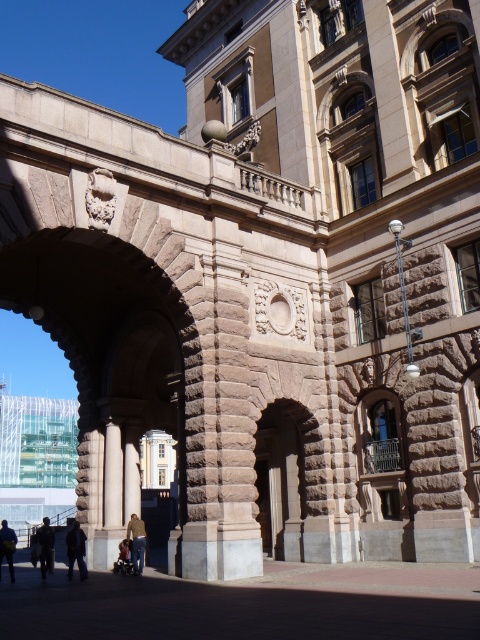
Question: Is brown stone pillar at center above dark gray fabric jacket at lower left?

Choices:
 (A) yes
 (B) no

Answer: (A)

Question: Based on their relative distances, which object is nearer to the dark brown leather jacket at lower center?

Choices:
 (A) dark brown leather jacket at lower left
 (B) dark blue jeans at lower left

Answer: (A)

Question: Estimate the real-world distances between objects in this image. Which object is closer to the dark blue jeans at lower left?

Choices:
 (A) dark brown leather jacket at lower center
 (B) dark gray fabric jacket at lower left

Answer: (B)

Question: Estimate the real-world distances between objects in this image. Which object is closer to the brown stone pillar at center?

Choices:
 (A) dark brown leather jacket at lower left
 (B) smooth stone pillar at center

Answer: (B)

Question: Does dark brown leather jacket at lower left appear on the right side of dark brown leather jacket at lower center?

Choices:
 (A) yes
 (B) no

Answer: (B)

Question: Is smooth stone pillar at center above dark brown leather jacket at lower left?

Choices:
 (A) no
 (B) yes

Answer: (B)